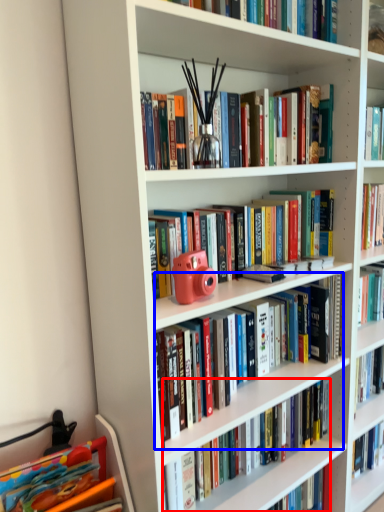
Question: Which object is closer to the camera taking this photo, book (highlighted by a red box) or book (highlighted by a blue box)?

Choices:
 (A) book
 (B) book

Answer: (B)